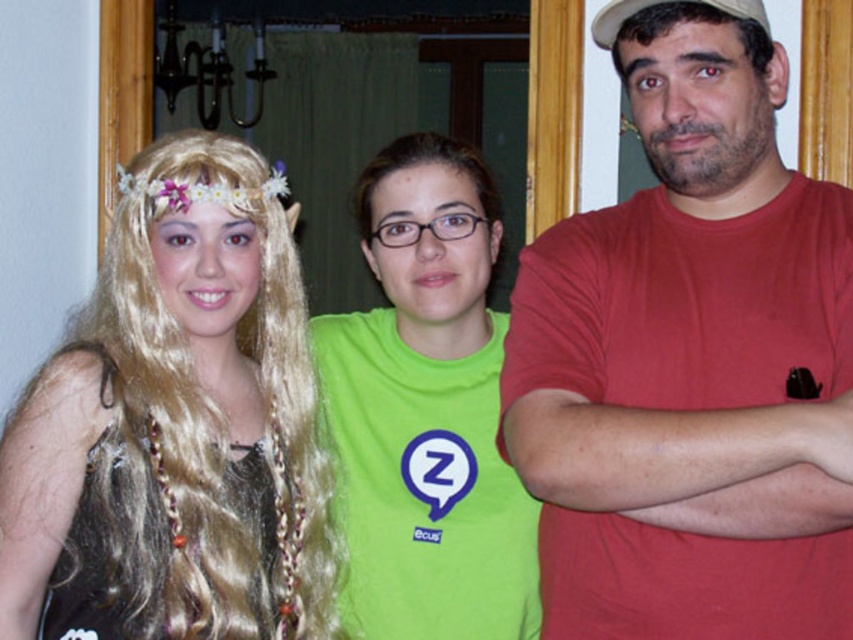
Question: Can you confirm if matte red t-shirt at center is bigger than blonde hair at left?

Choices:
 (A) yes
 (B) no

Answer: (A)

Question: Which point is farther from the camera taking this photo?

Choices:
 (A) (57, 403)
 (B) (621, 24)
 (C) (233, 406)
 (D) (519, 340)

Answer: (C)

Question: Which of these objects is positioned closest to the blonde wig at left?

Choices:
 (A) matte red t-shirt at center
 (B) green matte shirt at center
 (C) blonde hair at left

Answer: (C)

Question: Can you confirm if matte red t-shirt at center is thinner than white matte baseball cap at upper right?

Choices:
 (A) yes
 (B) no

Answer: (B)

Question: Observing the image, what is the correct spatial positioning of blonde wig at left in reference to white matte baseball cap at upper right?

Choices:
 (A) left
 (B) right

Answer: (A)

Question: Considering the real-world distances, which object is closest to the green matte shirt at center?

Choices:
 (A) blonde hair at left
 (B) matte red t-shirt at center
 (C) blonde wig at left
 (D) white matte baseball cap at upper right

Answer: (C)